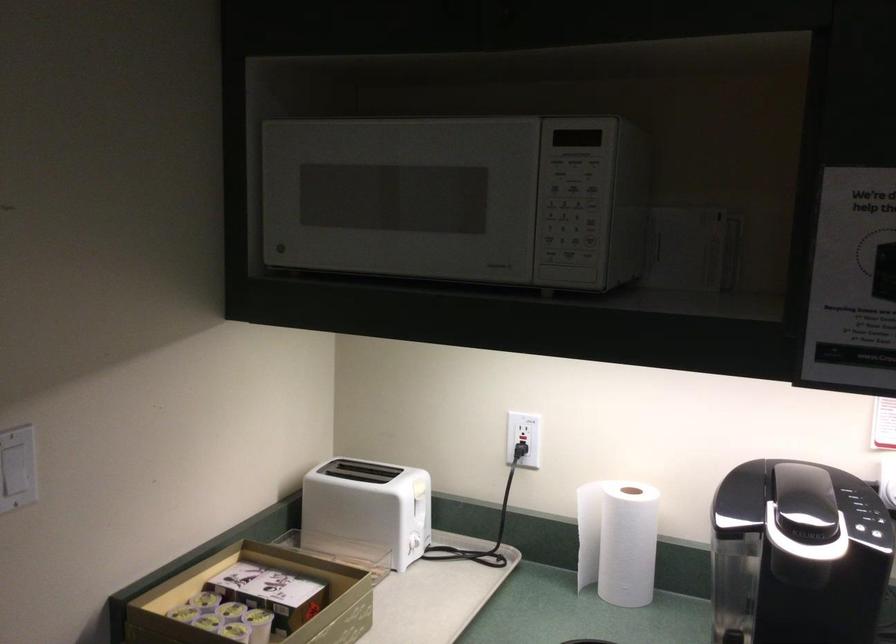
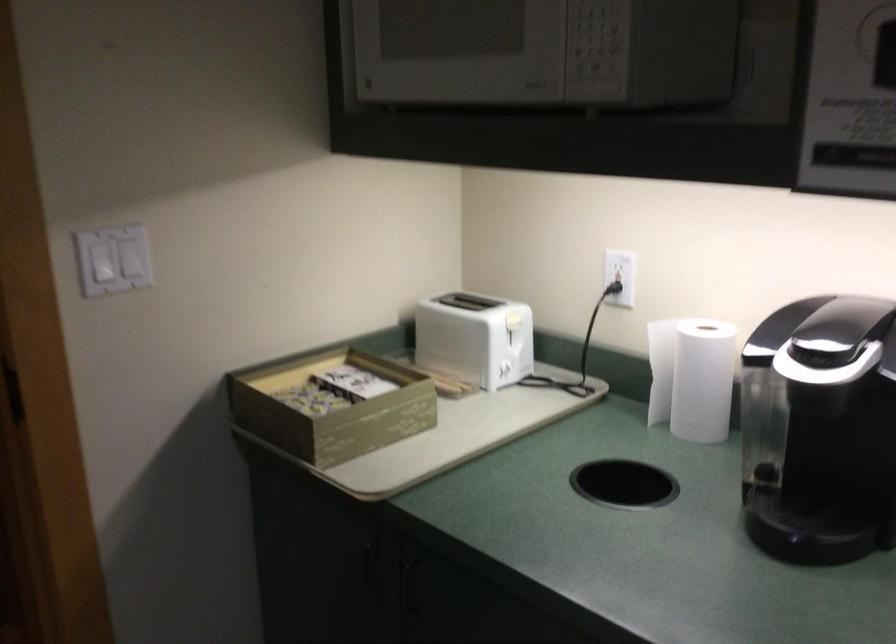
Where in the second image is the point corresponding to (419,489) from the first image?

(511, 317)